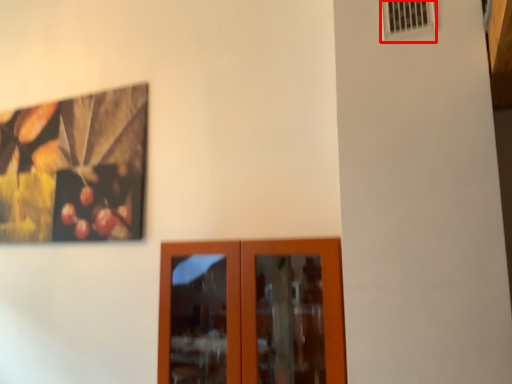
Question: From the image's perspective, where is air conditioning (annotated by the red box) located relative to door?

Choices:
 (A) below
 (B) above

Answer: (B)